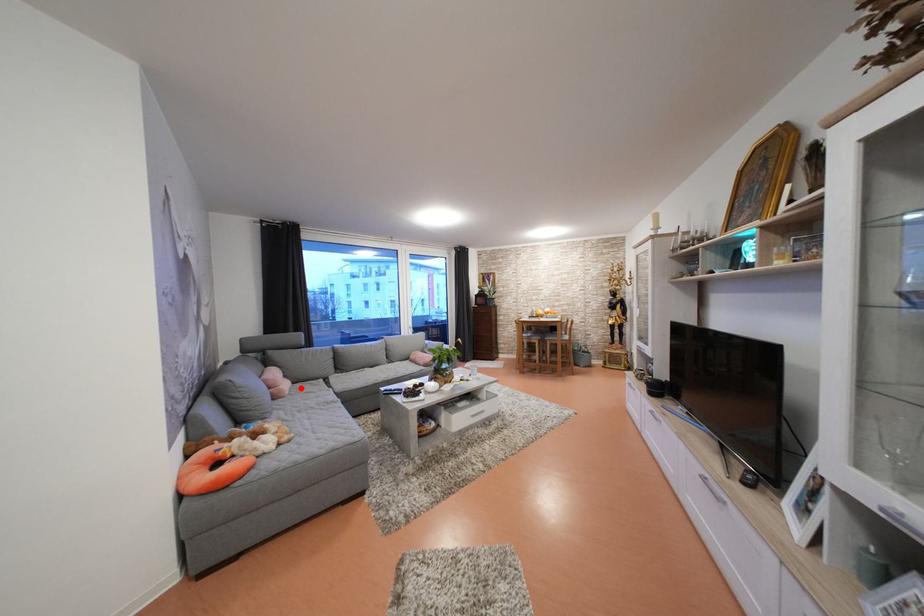
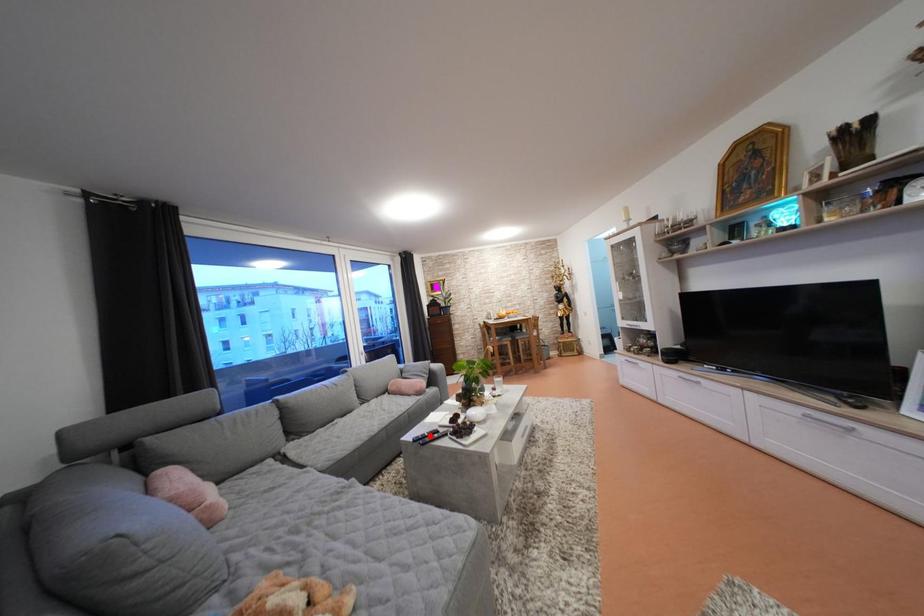
Consider the image. I am providing you with two images of the same scene from different viewpoints. A red point is marked on the first image and another point is marked on the second image. Is the red point in image1 aligned with the point shown in image2?

No